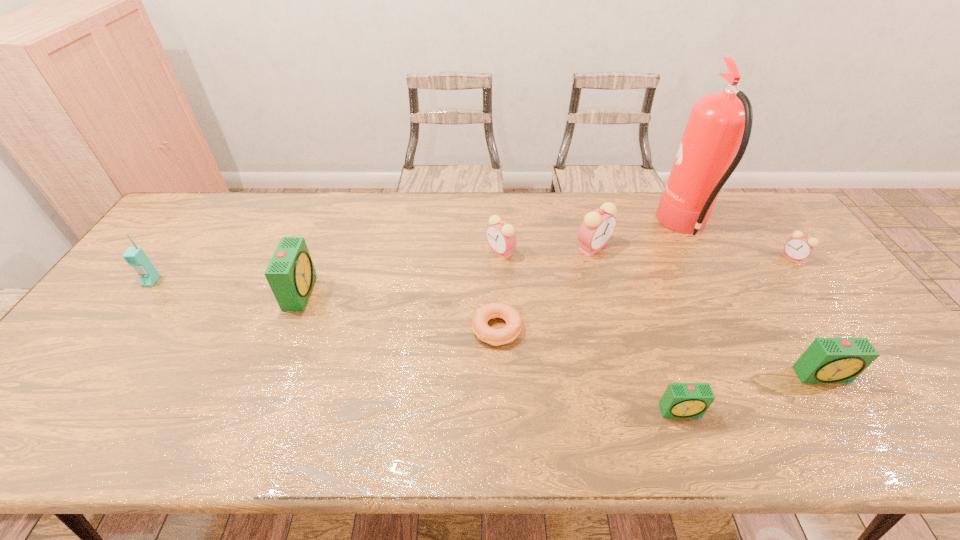
Image resolution: width=960 pixels, height=540 pixels. What are the coordinates of `vacant area between the rightmost alarm clock and the eighth object from right to left` in the screenshot? It's located at (546, 274).

What are the coordinates of `free spot between the leftmost pink alarm clock and the second pink alarm clock from left to right` in the screenshot? It's located at (547, 249).

Where is `free space between the second nearest alarm clock and the second green alarm clock from left to right`? free space between the second nearest alarm clock and the second green alarm clock from left to right is located at coordinates (752, 393).

Identify the location of blank region between the second alarm clock from left to right and the rightmost object. This screenshot has height=540, width=960. pyautogui.click(x=646, y=254).

You are a GUI agent. You are given a task and a screenshot of the screen. Output one action in this format:
    pyautogui.click(x=<x>, y=<y>)
    Task: Click on the vacant point located between the bagel and the leftmost object
    This screenshot has height=540, width=960.
    Given the screenshot: What is the action you would take?
    pyautogui.click(x=324, y=305)

Locate an element on the screen. The height and width of the screenshot is (540, 960). free area in between the second pink alarm clock from right to left and the bagel is located at coordinates (545, 288).

In order to click on free spot between the leftmost pink alarm clock and the smallest green alarm clock in this screenshot , I will do `click(590, 331)`.

Identify which object is the eighth nearest to the leftmost object. Please provide its 2D coordinates. Your answer should be formatted as a tuple, i.e. [(x, y)], where the tuple contains the x and y coordinates of a point satisfying the conditions above.

[(799, 247)]

Locate an element on the screen. This screenshot has width=960, height=540. object that is the fifth closest one to the second pink alarm clock from right to left is located at coordinates (799, 247).

The height and width of the screenshot is (540, 960). What are the coordinates of `alarm clock that is the fifth closest to the second pink alarm clock from left to right` in the screenshot? It's located at (291, 274).